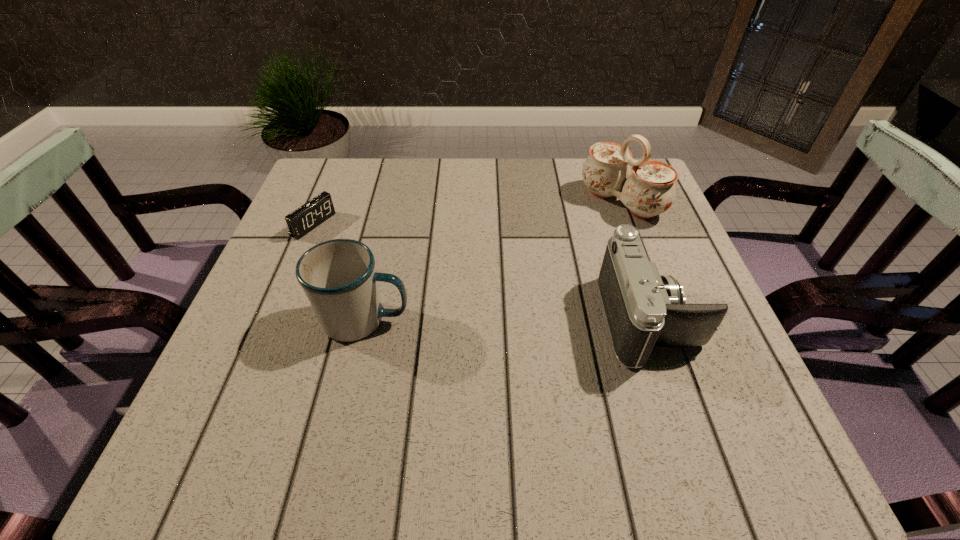
Find the location of a particular element. free space between the chinaware and the third object from right to left is located at coordinates (493, 261).

Locate an element on the screen. This screenshot has width=960, height=540. free spot between the shortest object and the chinaware is located at coordinates (468, 213).

Locate an element on the screen. empty space between the chinaware and the leftmost object is located at coordinates (468, 213).

You are a GUI agent. You are given a task and a screenshot of the screen. Output one action in this format:
    pyautogui.click(x=<x>, y=<y>)
    Task: Click on the unoccupied position between the third object from right to left and the camera
    This screenshot has height=540, width=960.
    Given the screenshot: What is the action you would take?
    pyautogui.click(x=507, y=320)

The width and height of the screenshot is (960, 540). What are the coordinates of `vacant point located between the camera and the shortest object` in the screenshot? It's located at (481, 272).

At what (x,y) coordinates should I click in order to perform the action: click on empty space that is in between the camera and the alarm clock. Please return your answer as a coordinate pair (x, y). Looking at the image, I should click on coord(481,272).

Locate an element on the screen. The width and height of the screenshot is (960, 540). object that is the second nearest to the chinaware is located at coordinates (338, 276).

I want to click on object that can be found as the closest to the mug, so click(x=307, y=217).

Locate an element on the screen. free space that satisfies the following two spatial constraints: 1. on the front side of the camera; 2. at the front of the shortest object with an open lens cover is located at coordinates click(274, 320).

Identify the location of free space that satisfies the following two spatial constraints: 1. on the front side of the shortest object; 2. at the front of the camera with an open lens cover. The height and width of the screenshot is (540, 960). (274, 320).